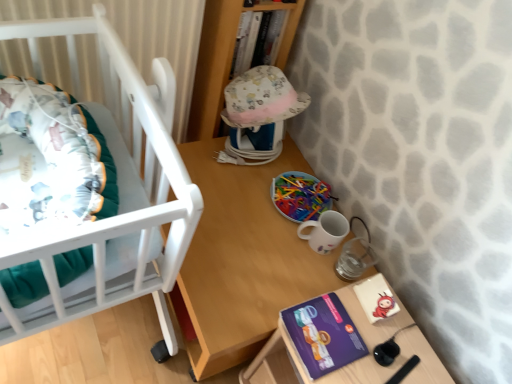
At what (x,y) coordinates should I click in order to perform the action: click on empty space that is ontop of multicolored plastic sticks at center. Please return your answer as a coordinate pair (x, y). The width and height of the screenshot is (512, 384). Looking at the image, I should click on (302, 189).